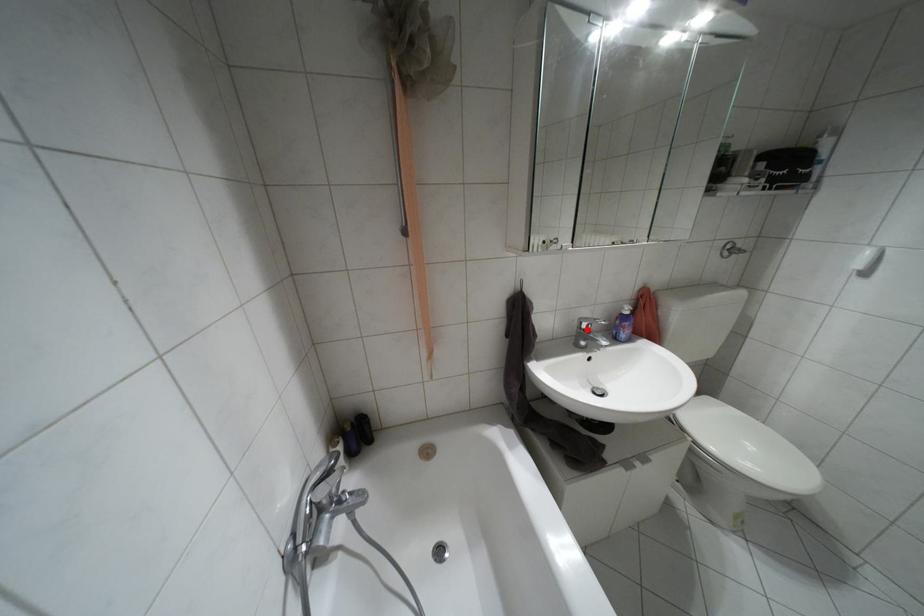
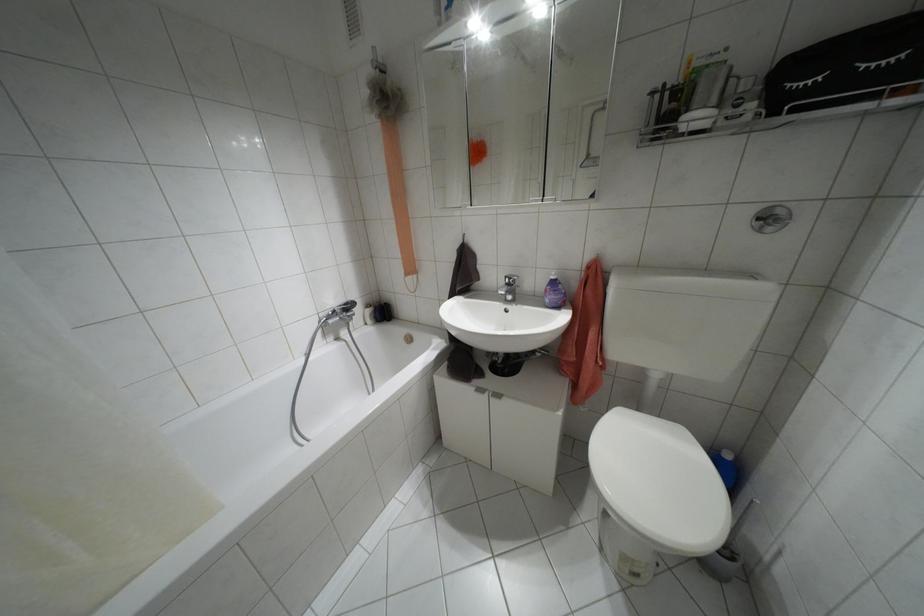
Locate, in the second image, the point that corresponds to the highlighted location in the first image.

(507, 284)